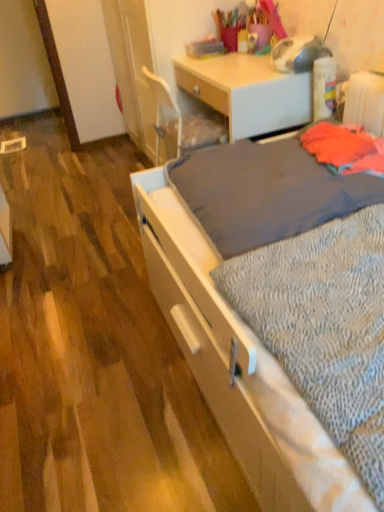
Question: Is matte wood desk at center in front of gray textured sheet at center?

Choices:
 (A) no
 (B) yes

Answer: (A)

Question: Is matte wood desk at center positioned beyond the bounds of gray textured sheet at center?

Choices:
 (A) no
 (B) yes

Answer: (B)

Question: Is matte wood desk at center at the right side of gray textured sheet at center?

Choices:
 (A) no
 (B) yes

Answer: (A)

Question: Does matte wood desk at center have a smaller size compared to gray textured sheet at center?

Choices:
 (A) yes
 (B) no

Answer: (B)

Question: Is matte wood desk at center facing towards gray textured sheet at center?

Choices:
 (A) no
 (B) yes

Answer: (A)

Question: Looking at their shapes, would you say gray textured sheet at center is wider or thinner than matte wood desk at center?

Choices:
 (A) wide
 (B) thin

Answer: (A)

Question: Considering their positions, is gray textured sheet at center located in front of or behind matte wood desk at center?

Choices:
 (A) front
 (B) behind

Answer: (A)

Question: Is gray textured sheet at center inside or outside of matte wood desk at center?

Choices:
 (A) inside
 (B) outside

Answer: (B)

Question: Based on their positions, is gray textured sheet at center located to the left or right of matte wood desk at center?

Choices:
 (A) left
 (B) right

Answer: (B)

Question: From a real-world perspective, is matte wood desk at center positioned above or below gray textured sheet at center?

Choices:
 (A) above
 (B) below

Answer: (B)

Question: Is matte wood desk at center situated inside gray textured sheet at center or outside?

Choices:
 (A) outside
 (B) inside

Answer: (A)

Question: In the image, is matte wood desk at center on the left side or the right side of gray textured sheet at center?

Choices:
 (A) right
 (B) left

Answer: (B)

Question: Considering the positions of matte wood desk at center and gray textured sheet at center in the image, is matte wood desk at center bigger or smaller than gray textured sheet at center?

Choices:
 (A) small
 (B) big

Answer: (B)

Question: Does point (253, 84) appear closer or farther from the camera than point (261, 158)?

Choices:
 (A) closer
 (B) farther

Answer: (B)

Question: Would you say matte wood desk at center is to the left or to the right of textured gray blanket at center in the picture?

Choices:
 (A) left
 (B) right

Answer: (A)